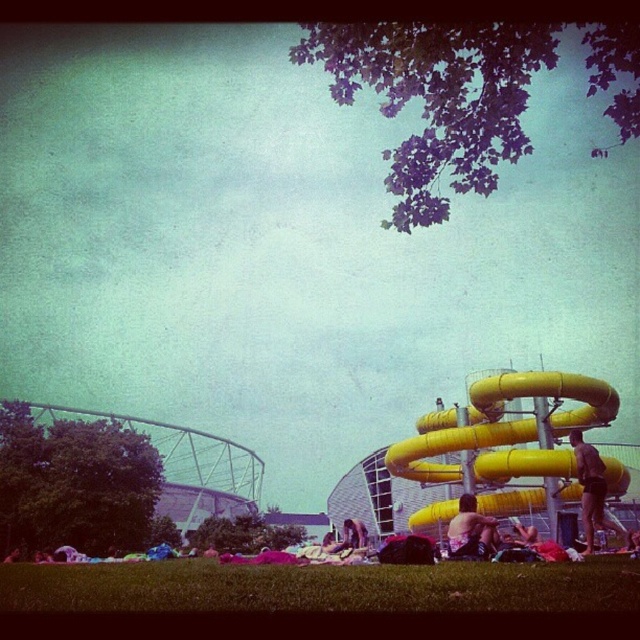
Which is behind, point (502, 564) or point (572, 456)?

Positioned behind is point (572, 456).

Does point (541, 570) lie behind point (556, 458)?

No, it is in front of (556, 458).

At what (x,y) coordinates should I click in order to perform the action: click on green grass at lower center. Please return your answer as a coordinate pair (x, y). Looking at the image, I should click on (321, 586).

I want to click on green grass at lower center, so click(x=321, y=586).

Can you confirm if green grass at lower center is wider than smooth yellow slide at right?

Correct, the width of green grass at lower center exceeds that of smooth yellow slide at right.

Can you confirm if green grass at lower center is thinner than smooth yellow slide at right?

In fact, green grass at lower center might be wider than smooth yellow slide at right.

Where is `green grass at lower center`? This screenshot has width=640, height=640. green grass at lower center is located at coordinates (321, 586).

Find the location of a particular element. This screenshot has height=640, width=640. green grass at lower center is located at coordinates (321, 586).

Does yellow rubber slide at right appear over smooth yellow slide at right?

Correct, yellow rubber slide at right is located above smooth yellow slide at right.

Between point (557, 465) and point (595, 484), which one is positioned behind?

Positioned behind is point (595, 484).

Is point (493, 401) positioned behind point (577, 461)?

Yes.

At what (x,y) coordinates should I click in order to perform the action: click on yellow rubber slide at right. Please return your answer as a coordinate pair (x, y). Looking at the image, I should click on (508, 429).